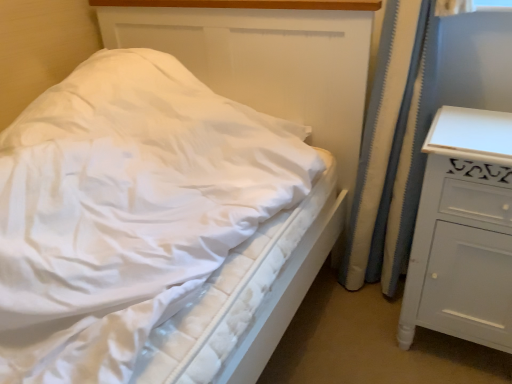
Question: Does white textured curtain at right lie behind white quilted mattress at center?

Choices:
 (A) yes
 (B) no

Answer: (A)

Question: From a real-world perspective, does white textured curtain at right stand above white quilted mattress at center?

Choices:
 (A) yes
 (B) no

Answer: (A)

Question: Considering the relative sizes of white textured curtain at right and white quilted mattress at center in the image provided, is white textured curtain at right bigger than white quilted mattress at center?

Choices:
 (A) no
 (B) yes

Answer: (A)

Question: From a real-world perspective, is white textured curtain at right beneath white quilted mattress at center?

Choices:
 (A) no
 (B) yes

Answer: (A)

Question: Is white textured curtain at right positioned before white quilted mattress at center?

Choices:
 (A) no
 (B) yes

Answer: (A)

Question: Looking at their shapes, would you say white textured curtain at right is wider or thinner than white quilted mattress at center?

Choices:
 (A) thin
 (B) wide

Answer: (A)

Question: Is white textured curtain at right inside or outside of white quilted mattress at center?

Choices:
 (A) inside
 (B) outside

Answer: (B)

Question: Considering their positions, is white textured curtain at right located in front of or behind white quilted mattress at center?

Choices:
 (A) behind
 (B) front

Answer: (A)

Question: Is white textured curtain at right to the left or to the right of white quilted mattress at center in the image?

Choices:
 (A) right
 (B) left

Answer: (A)

Question: From the image's perspective, is white quilted mattress at center above or below white painted wood chest of drawers at right?

Choices:
 (A) above
 (B) below

Answer: (A)

Question: Is white quilted mattress at center taller or shorter than white painted wood chest of drawers at right?

Choices:
 (A) short
 (B) tall

Answer: (B)

Question: Is point (254, 200) positioned closer to the camera than point (460, 117)?

Choices:
 (A) closer
 (B) farther

Answer: (A)

Question: From a real-world perspective, is white quilted mattress at center above or below white painted wood chest of drawers at right?

Choices:
 (A) above
 (B) below

Answer: (A)

Question: In terms of height, does white painted wood chest of drawers at right look taller or shorter compared to white textured curtain at right?

Choices:
 (A) tall
 (B) short

Answer: (B)

Question: Choose the correct answer: Is white painted wood chest of drawers at right inside white textured curtain at right or outside it?

Choices:
 (A) outside
 (B) inside

Answer: (A)